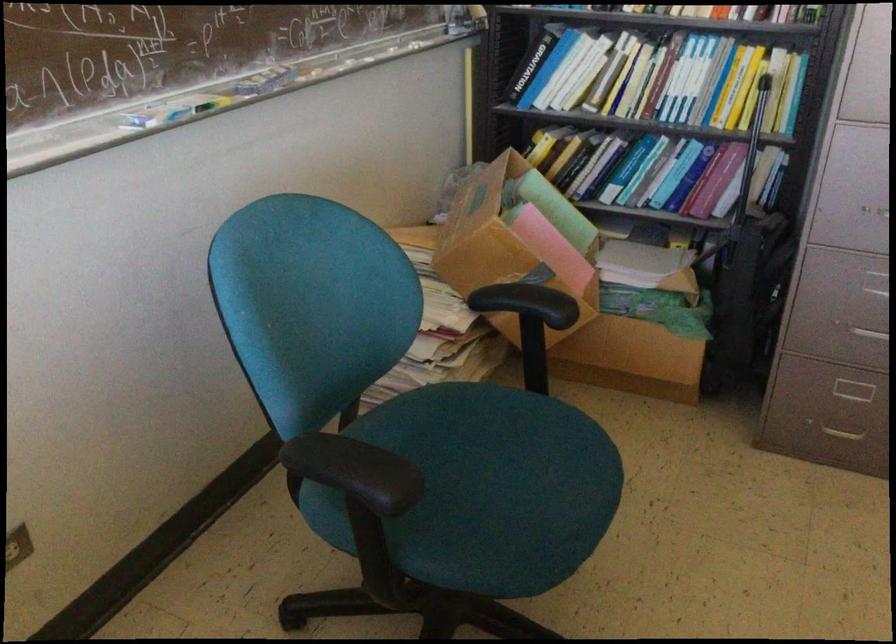
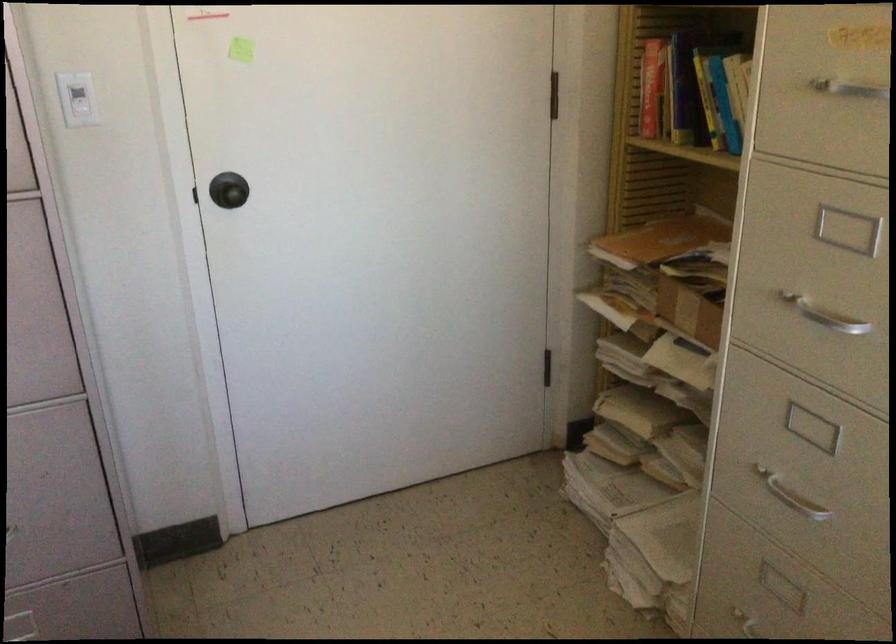
Question: How did the camera likely rotate?

Choices:
 (A) Left
 (B) Right
 (C) Up
 (D) Down

Answer: (B)